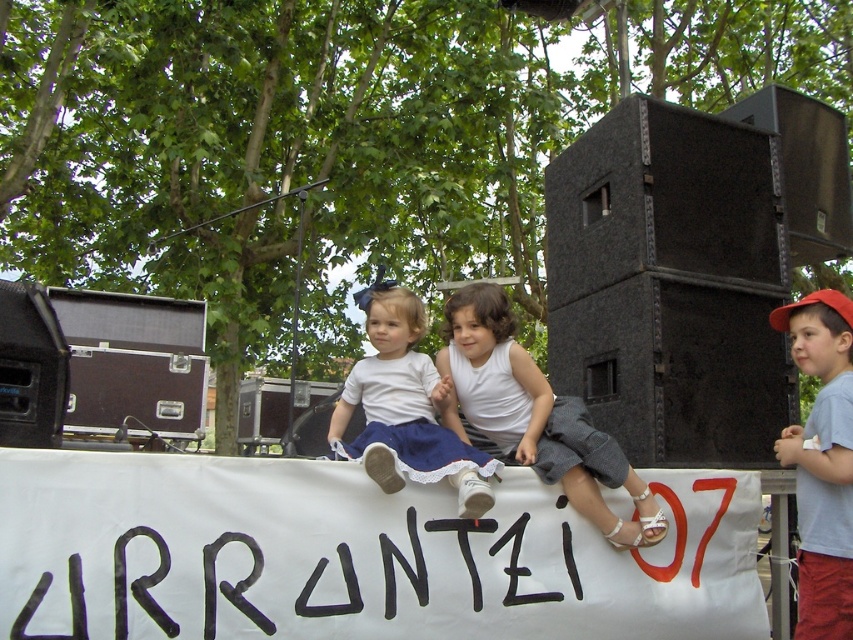
From the picture: You are standing at the center of the scene and want to place a new decoration exactly where the white paper banner at center is currently located. What coordinates should you use for this placement?

The white paper banner at center is located at point [355,554], so you should use those coordinates to place the new decoration there.

You are a photographer at the event and want to capture both the white paper banner at center and the white cotton dress at center in the same frame. Which object should you focus on first to ensure both are in the shot?

The white paper banner at center is shorter than the white cotton dress at center, so you should focus on the white cotton dress at center first to ensure both are in the shot.